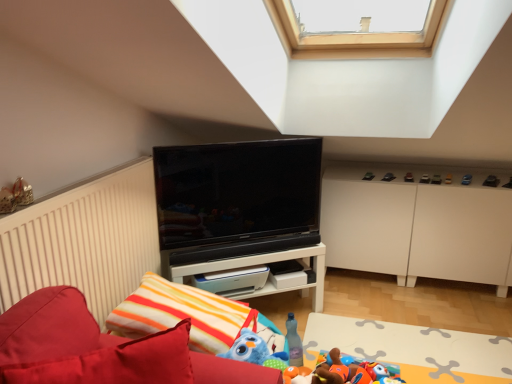
At what (x,y) coordinates should I click in order to perform the action: click on vacant space behind metallic black toy car at upper right, the 3th toy from the bottom. Please return your answer as a coordinate pair (x, y). Looking at the image, I should click on (467, 172).